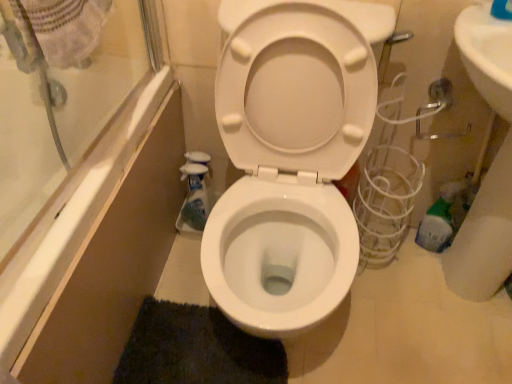
Image resolution: width=512 pixels, height=384 pixels. I want to click on free space to the right of dark green textured bath mat at lower center, so (342, 344).